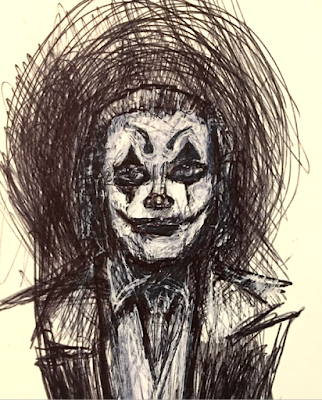
Find the location of a particular element. The height and width of the screenshot is (400, 322). art drawing is located at coordinates (120, 143).